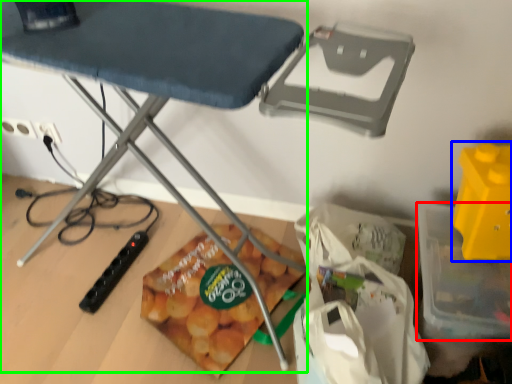
Question: Estimate the real-world distances between objects in this image. Which object is farther from storage box (highlighted by a red box), toy (highlighted by a blue box) or table (highlighted by a green box)?

Choices:
 (A) toy
 (B) table

Answer: (B)